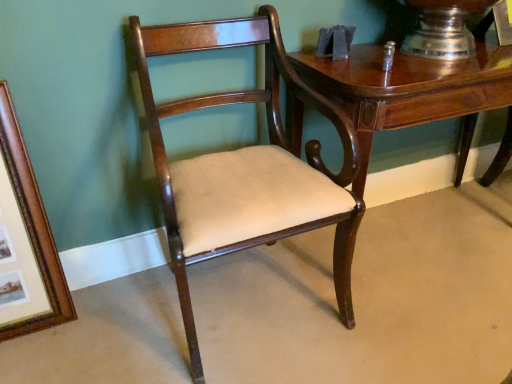
Question: Is wooden picture frame at left shorter than glossy wood table at upper right?

Choices:
 (A) yes
 (B) no

Answer: (B)

Question: Considering the relative sizes of wooden picture frame at left and glossy wood table at upper right in the image provided, is wooden picture frame at left smaller than glossy wood table at upper right?

Choices:
 (A) no
 (B) yes

Answer: (B)

Question: Does wooden picture frame at left appear on the left side of glossy wood table at upper right?

Choices:
 (A) yes
 (B) no

Answer: (A)

Question: Considering the relative sizes of wooden picture frame at left and glossy wood table at upper right in the image provided, is wooden picture frame at left bigger than glossy wood table at upper right?

Choices:
 (A) no
 (B) yes

Answer: (A)

Question: Does wooden picture frame at left have a lesser width compared to glossy wood table at upper right?

Choices:
 (A) no
 (B) yes

Answer: (B)

Question: Is the surface of wooden picture frame at left in direct contact with glossy wood table at upper right?

Choices:
 (A) yes
 (B) no

Answer: (B)

Question: Does glossy wood table at upper right have a larger size compared to wooden picture frame at left?

Choices:
 (A) yes
 (B) no

Answer: (A)

Question: Can we say glossy wood table at upper right lies outside wooden picture frame at left?

Choices:
 (A) no
 (B) yes

Answer: (B)

Question: Is glossy wood table at upper right to the right of wooden picture frame at left from the viewer's perspective?

Choices:
 (A) yes
 (B) no

Answer: (A)

Question: Does glossy wood table at upper right have a smaller size compared to wooden picture frame at left?

Choices:
 (A) no
 (B) yes

Answer: (A)

Question: Is the position of glossy wood table at upper right less distant than that of wooden picture frame at left?

Choices:
 (A) yes
 (B) no

Answer: (B)

Question: Is glossy wood table at upper right thinner than wooden picture frame at left?

Choices:
 (A) no
 (B) yes

Answer: (A)

Question: Does wooden picture frame at left touch mahogany wood chair at center?

Choices:
 (A) yes
 (B) no

Answer: (B)